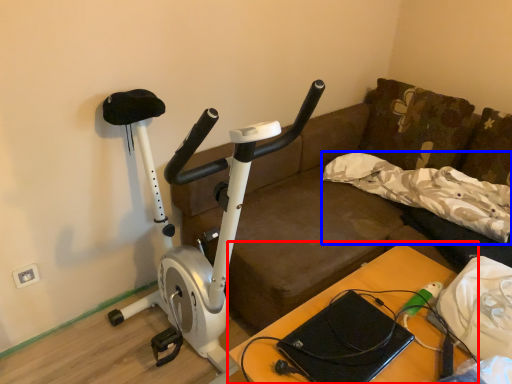
Question: Which point is further to the camera, table (highlighted by a red box) or pillow (highlighted by a blue box)?

Choices:
 (A) table
 (B) pillow

Answer: (B)